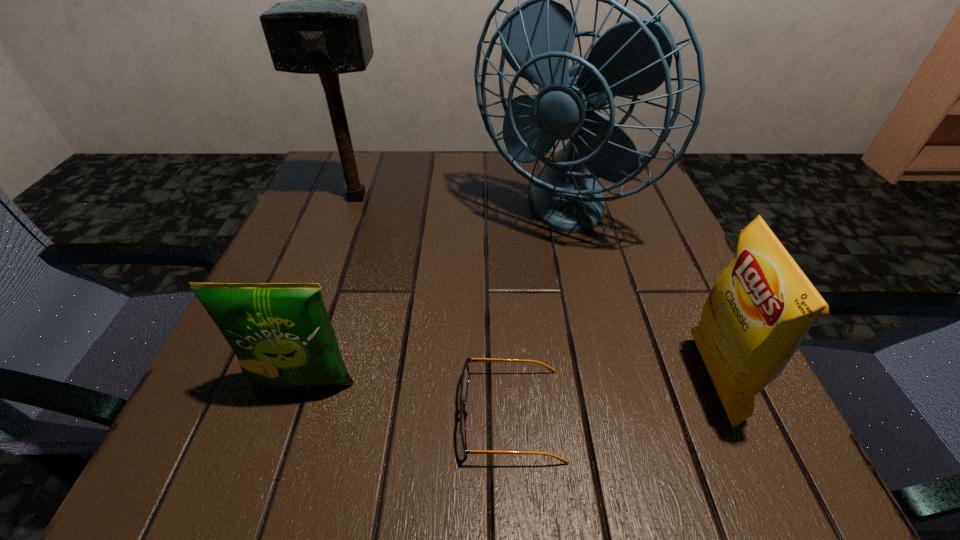
You are a GUI agent. You are given a task and a screenshot of the screen. Output one action in this format:
    pyautogui.click(x=<x>, y=<y>)
    Task: Click on the fan situated at the right edge
    Image resolution: width=960 pixels, height=540 pixels.
    Given the screenshot: What is the action you would take?
    pyautogui.click(x=633, y=57)

The height and width of the screenshot is (540, 960). I want to click on crisp (potato chip) located at the right edge, so click(759, 310).

What are the coordinates of `object located at the far left corner` in the screenshot? It's located at tap(319, 33).

You are a GUI agent. You are given a task and a screenshot of the screen. Output one action in this format:
    pyautogui.click(x=<x>, y=<y>)
    Task: Click on the object present at the far right corner
    The height and width of the screenshot is (540, 960).
    Given the screenshot: What is the action you would take?
    pyautogui.click(x=633, y=57)

This screenshot has width=960, height=540. In order to click on object present at the near right corner in this screenshot , I will do `click(759, 310)`.

Identify the location of vacant space at the far edge of the desktop. The width and height of the screenshot is (960, 540). (479, 167).

The height and width of the screenshot is (540, 960). In the image, there is a desktop. Find the location of `vacant space at the near edge`. vacant space at the near edge is located at coordinates (646, 476).

This screenshot has width=960, height=540. In the image, there is a desktop. Find the location of `free space at the left edge`. free space at the left edge is located at coordinates (335, 218).

Where is `vacant area at the right edge`? This screenshot has height=540, width=960. vacant area at the right edge is located at coordinates (697, 290).

This screenshot has height=540, width=960. Find the location of `free space at the far left corner of the desktop`. free space at the far left corner of the desktop is located at coordinates (365, 205).